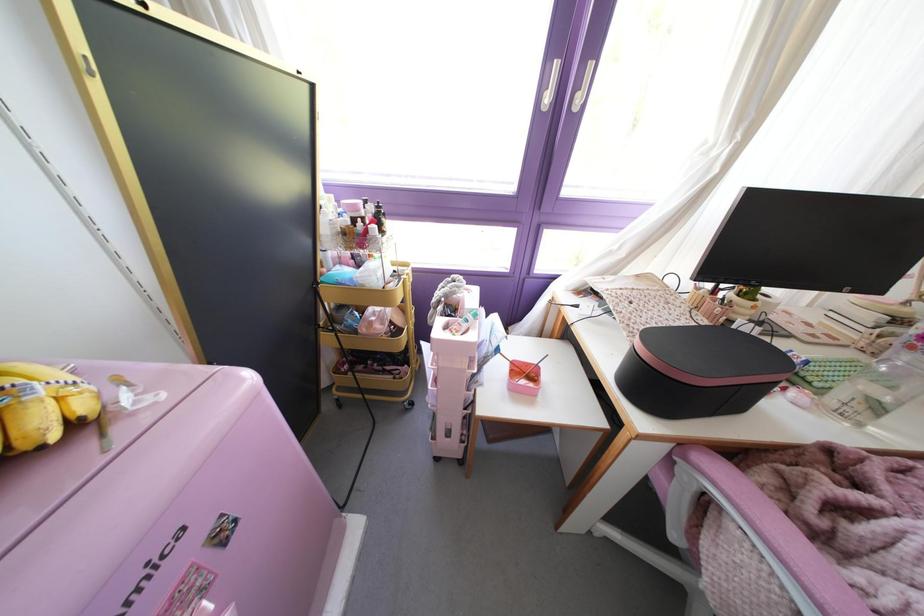
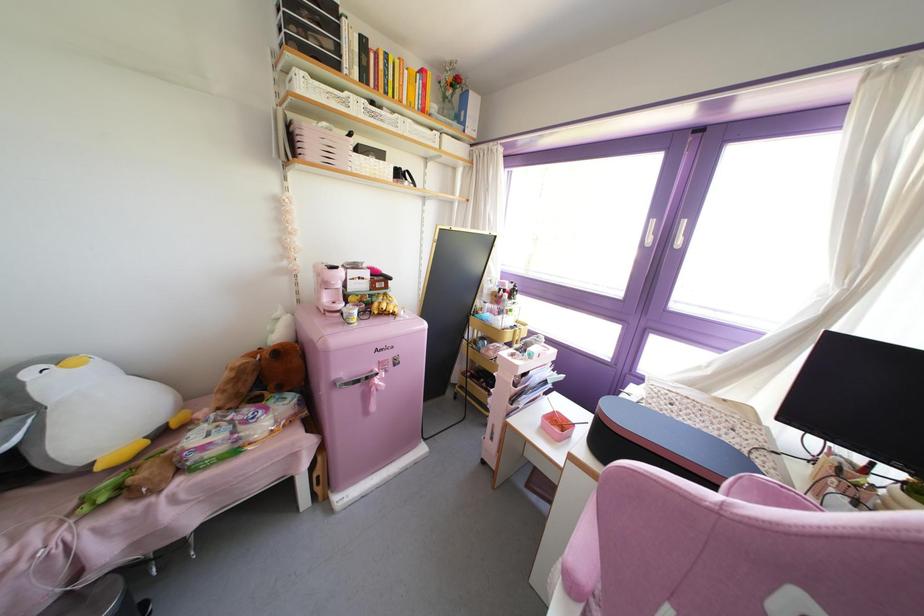
Find the pixel in the second image that matches point 555,65 in the first image.

(652, 222)